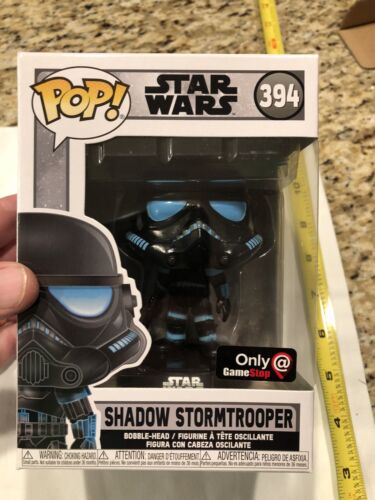
Where is `toy`? toy is located at coordinates (202, 226).